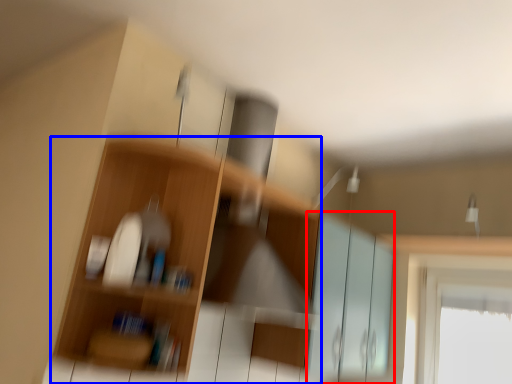
Question: Among these objects, which one is nearest to the camera, screen door (highlighted by a red box) or shelf (highlighted by a blue box)?

Choices:
 (A) screen door
 (B) shelf

Answer: (B)